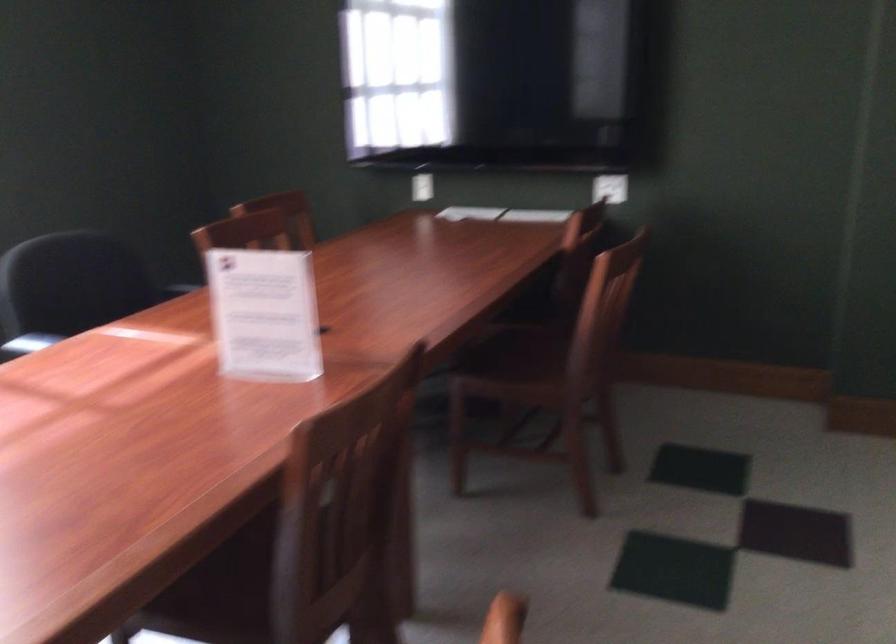
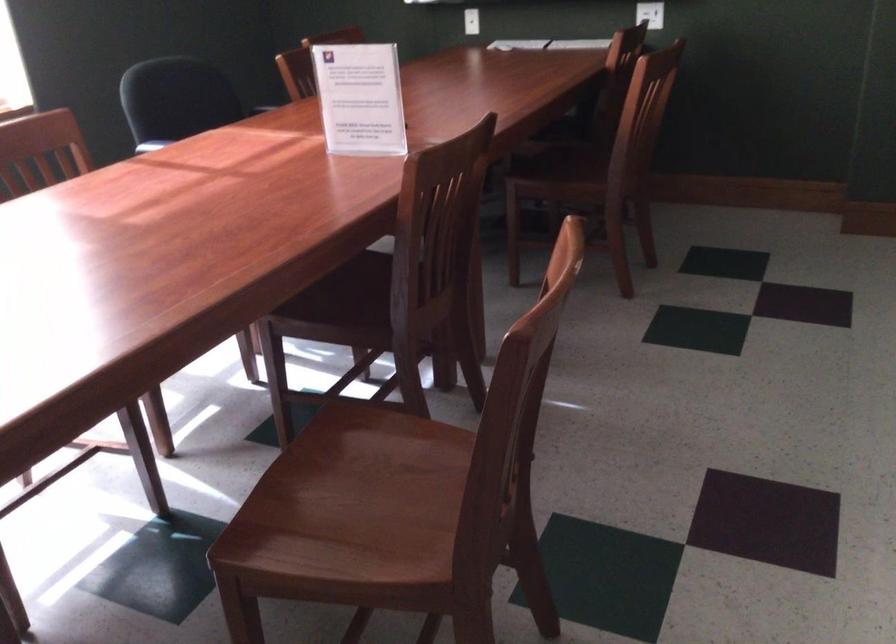
The point at (421,189) is marked in the first image. Where is the corresponding point in the second image?

(471, 21)